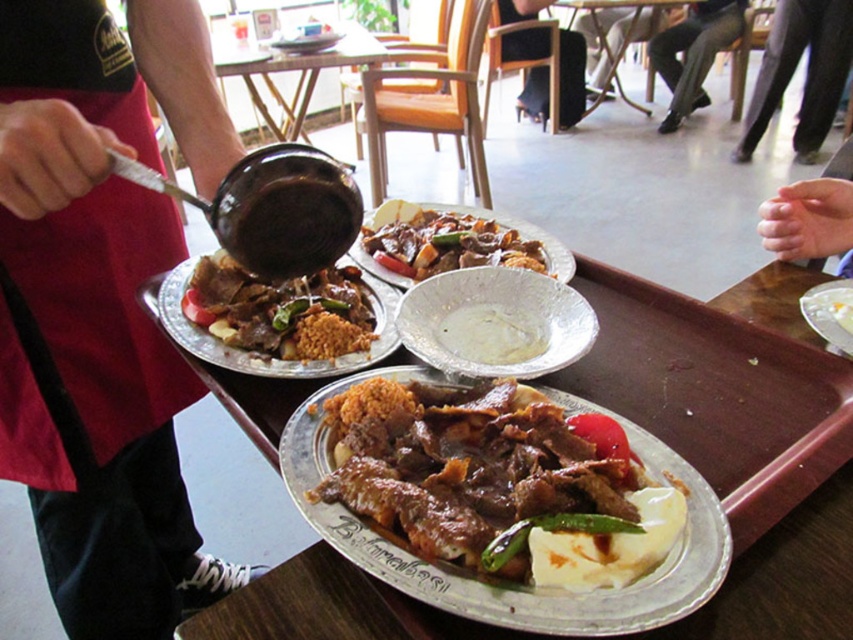
Question: Can you confirm if red apron at left is positioned to the left of black leather pants at lower right?

Choices:
 (A) yes
 (B) no

Answer: (A)

Question: Based on their relative distances, which object is farther from the brown matte rice at center?

Choices:
 (A) black leather pants at lower right
 (B) silver metallic tray at center

Answer: (A)

Question: Can you confirm if red apron at left is wider than brown matte rice at center?

Choices:
 (A) no
 (B) yes

Answer: (B)

Question: Can you confirm if brown glossy meat at center is positioned to the left of black leather pants at lower right?

Choices:
 (A) yes
 (B) no

Answer: (A)

Question: Which object is positioned farthest from the black pants at lower right?

Choices:
 (A) brushed metal table at center
 (B) black leather pants at lower right
 (C) white glossy plate at lower right
 (D) red apron at left

Answer: (D)

Question: Which object appears closest to the camera in this image?

Choices:
 (A) black leather pants at lower right
 (B) brown meaty stew at center
 (C) white creamy mashed potato at center
 (D) white glossy plate at lower right

Answer: (B)